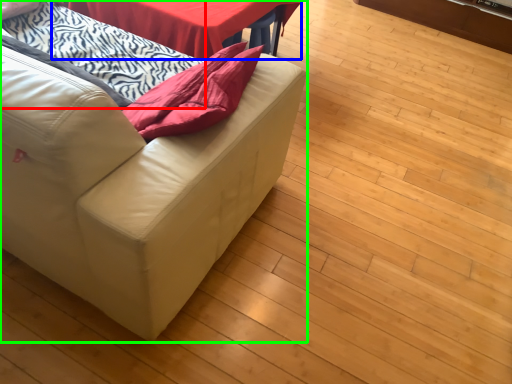
Question: Which is nearer to the blanket (highlighted by a red box)? table (highlighted by a blue box) or studio couch (highlighted by a green box).

Choices:
 (A) table
 (B) studio couch

Answer: (A)